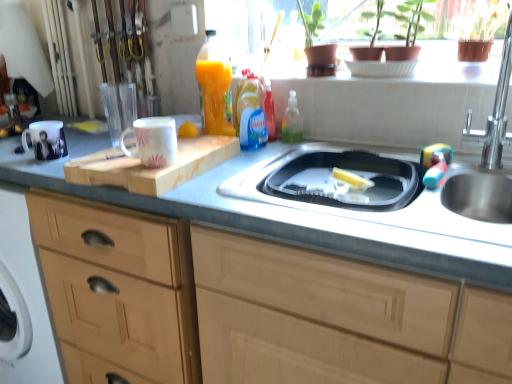
Question: Can you confirm if wooden cabinet at left, which is counted as the 1th cabinetry, starting from the right, is thinner than stainless steel sink at right, which appears as the 2th sink when ordered from the bottom?

Choices:
 (A) no
 (B) yes

Answer: (A)

Question: Can you confirm if wooden cabinet at left, placed as the 2th cabinetry when sorted from left to right, is positioned to the left of stainless steel sink at right, marked as the 1th sink in a top-to-bottom arrangement?

Choices:
 (A) yes
 (B) no

Answer: (A)

Question: Are wooden cabinet at left, which is counted as the 1th cabinetry, starting from the right, and stainless steel sink at right, marked as the 1th sink in a top-to-bottom arrangement, located far from each other?

Choices:
 (A) yes
 (B) no

Answer: (B)

Question: Considering the relative positions of wooden cabinet at left, which is counted as the 1th cabinetry, starting from the right, and stainless steel sink at right, marked as the 1th sink in a top-to-bottom arrangement, in the image provided, is wooden cabinet at left, which is counted as the 1th cabinetry, starting from the right, to the right of stainless steel sink at right, marked as the 1th sink in a top-to-bottom arrangement, from the viewer's perspective?

Choices:
 (A) yes
 (B) no

Answer: (B)

Question: Considering the relative sizes of wooden cabinet at left, which is counted as the 1th cabinetry, starting from the right, and stainless steel sink at right, which appears as the 2th sink when ordered from the bottom, in the image provided, is wooden cabinet at left, which is counted as the 1th cabinetry, starting from the right, wider than stainless steel sink at right, which appears as the 2th sink when ordered from the bottom,?

Choices:
 (A) no
 (B) yes

Answer: (B)

Question: Does wooden cabinet at left, which is counted as the 1th cabinetry, starting from the right, have a greater height compared to stainless steel sink at right, which appears as the 2th sink when ordered from the bottom?

Choices:
 (A) no
 (B) yes

Answer: (B)

Question: Is yellow matte lemon at center, placed as the 1th food when sorted from top to bottom, closer to the viewer compared to white glossy mug at left, arranged as the 1th mug when viewed from the back?

Choices:
 (A) no
 (B) yes

Answer: (A)

Question: Does yellow matte lemon at center, the 2th food when ordered from right to left, turn towards white glossy mug at left, arranged as the 1th mug when viewed from the back?

Choices:
 (A) no
 (B) yes

Answer: (A)

Question: Is the position of yellow matte lemon at center, the 1th food from the back, more distant than that of white glossy mug at left, arranged as the 1th mug when viewed from the back?

Choices:
 (A) yes
 (B) no

Answer: (A)

Question: Is yellow matte lemon at center, the second food positioned from the bottom, at the left side of white glossy mug at left, which is the 1th mug from left to right?

Choices:
 (A) no
 (B) yes

Answer: (A)

Question: From the image's perspective, is yellow matte lemon at center, the 1th food in the left-to-right sequence, over white glossy mug at left, which is the 1th mug from left to right?

Choices:
 (A) yes
 (B) no

Answer: (A)

Question: Is yellow matte lemon at center, placed as the 1th food when sorted from top to bottom, positioned with its back to white glossy mug at left, which ranks as the 2th mug in right-to-left order?

Choices:
 (A) yes
 (B) no

Answer: (B)

Question: Is wooden cutting board at center shorter than stainless steel sink at center, the 1th sink ordered from the bottom?

Choices:
 (A) no
 (B) yes

Answer: (B)